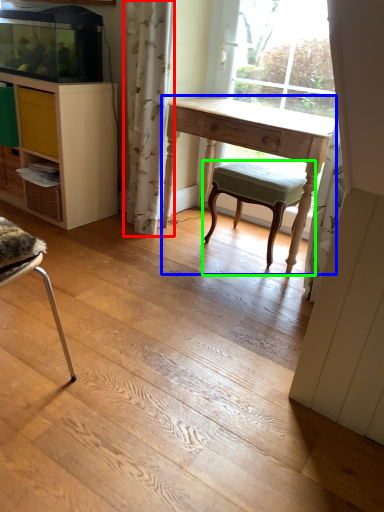
Question: Which object is positioned farthest from curtain (highlighted by a red box)? Select from desk (highlighted by a blue box) and stool (highlighted by a green box).

Choices:
 (A) desk
 (B) stool

Answer: (B)